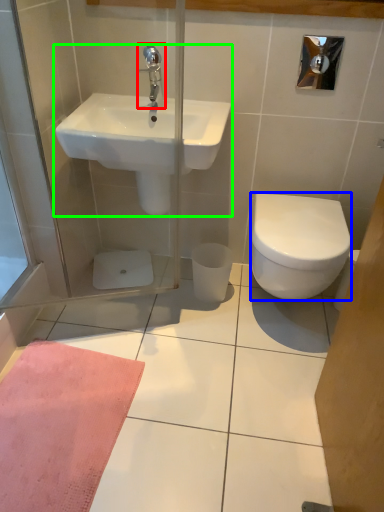
Question: Which object is the farthest from tap (highlighted by a red box)? Choose among these: bidet (highlighted by a blue box) or sink (highlighted by a green box).

Choices:
 (A) bidet
 (B) sink

Answer: (A)